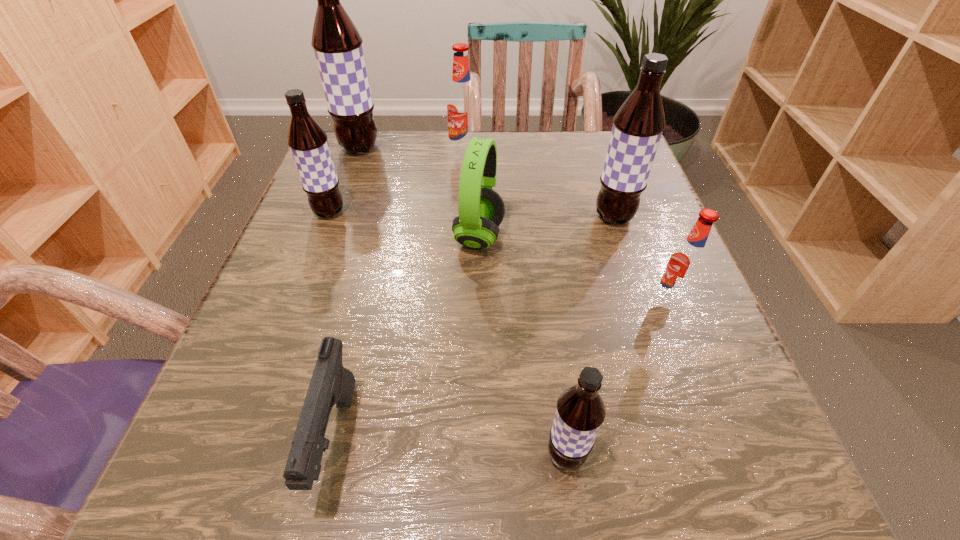
Where is `vacant area that lies between the headset and the smaller red root beer`? The height and width of the screenshot is (540, 960). vacant area that lies between the headset and the smaller red root beer is located at coordinates (574, 269).

Locate an element on the screen. vacant space that's between the second smallest brown root beer and the headset is located at coordinates (404, 225).

Identify the location of empty location between the third biggest brown root beer and the farthest brown root beer. Image resolution: width=960 pixels, height=540 pixels. (345, 180).

Where is `vacant area between the second tallest root beer and the nearest brown root beer`? vacant area between the second tallest root beer and the nearest brown root beer is located at coordinates (589, 336).

This screenshot has height=540, width=960. Identify the location of free point between the farthest brown root beer and the third object from left to right. (348, 294).

Find the location of `free point between the nearest brown root beer and the smaller red root beer`. free point between the nearest brown root beer and the smaller red root beer is located at coordinates (617, 379).

This screenshot has height=540, width=960. In order to click on vacant region between the nearer red root beer and the second smallest brown root beer in this screenshot , I will do `click(499, 257)`.

You are a GUI agent. You are given a task and a screenshot of the screen. Output one action in this format:
    pyautogui.click(x=<x>, y=<y>)
    Task: Click on the blank region between the smaller red root beer and the nearest root beer
    The image size is (960, 540).
    Given the screenshot: What is the action you would take?
    pyautogui.click(x=617, y=379)

This screenshot has height=540, width=960. Identify the location of the sixth closest object relative to the tallest root beer. (687, 263).

Locate an element on the screen. This screenshot has height=540, width=960. object that is the closest to the third biggest brown root beer is located at coordinates (337, 44).